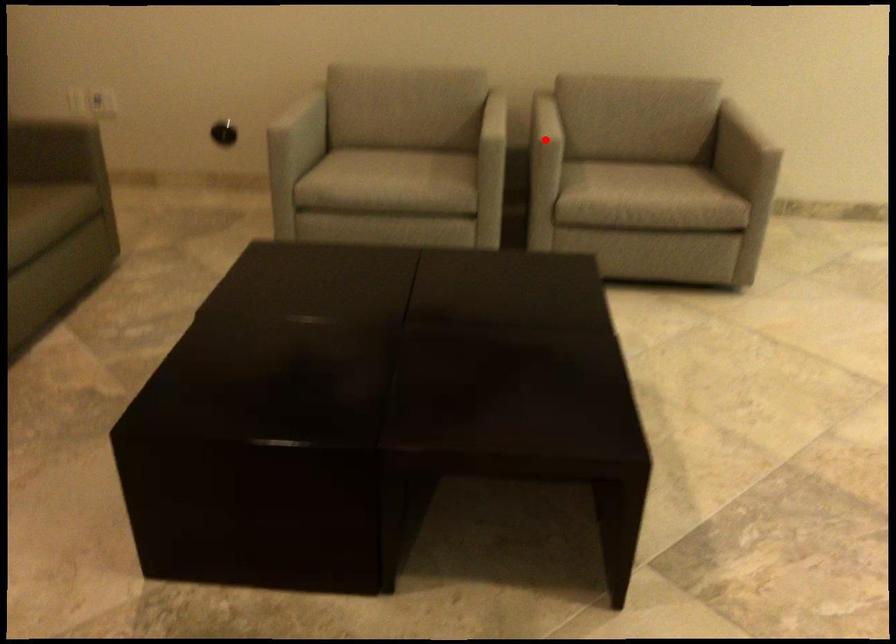
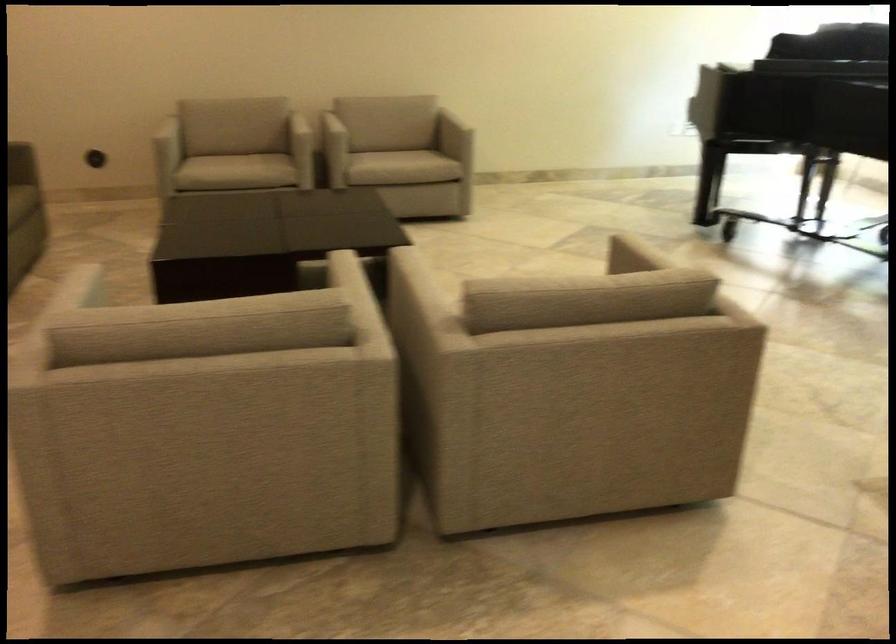
Question: I am providing you with two images of the same scene from different viewpoints. In image1, a red point is highlighted. Considering the same 3D point in image2, which of the following is correct?

Choices:
 (A) It is closer
 (B) It is farther

Answer: (B)